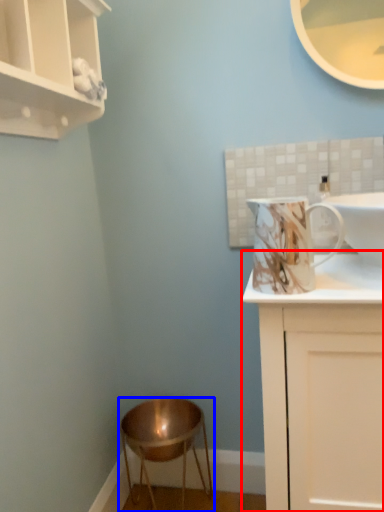
Question: Which object appears closest to the camera in this image, cabinetry (highlighted by a red box) or stool (highlighted by a blue box)?

Choices:
 (A) cabinetry
 (B) stool

Answer: (A)